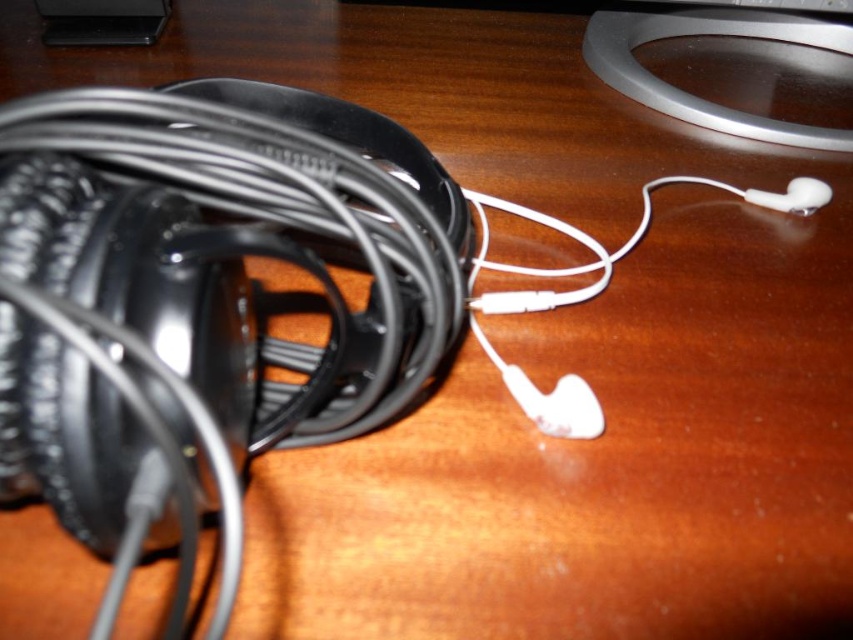
Question: Which of the following is the closest to the observer?

Choices:
 (A) (804, 212)
 (B) (192, 184)

Answer: (B)

Question: Can you confirm if black matte wire at left is bigger than white matte earphone at center-right?

Choices:
 (A) no
 (B) yes

Answer: (B)

Question: Does black matte wire at left have a greater width compared to white matte earphone at center-right?

Choices:
 (A) no
 (B) yes

Answer: (B)

Question: In this image, where is black matte wire at left located relative to white matte earphone at center-right?

Choices:
 (A) right
 (B) left

Answer: (B)